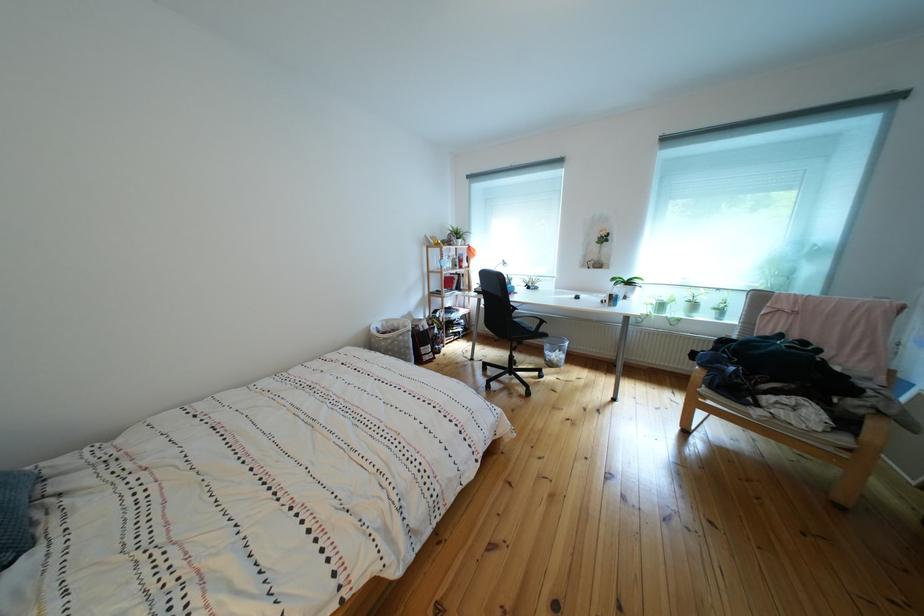
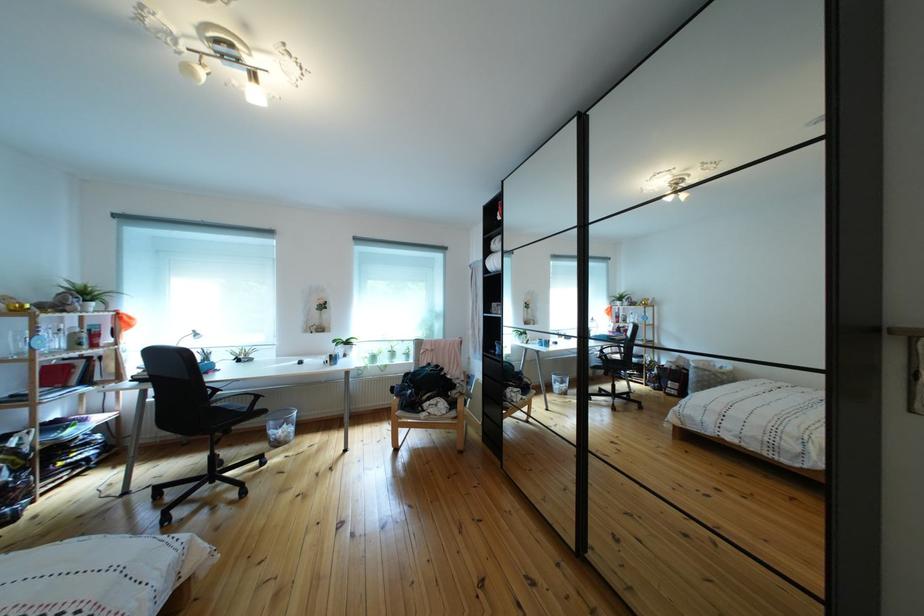
Find the pixel in the second image that matches the point at 882,399 in the first image.

(469, 391)